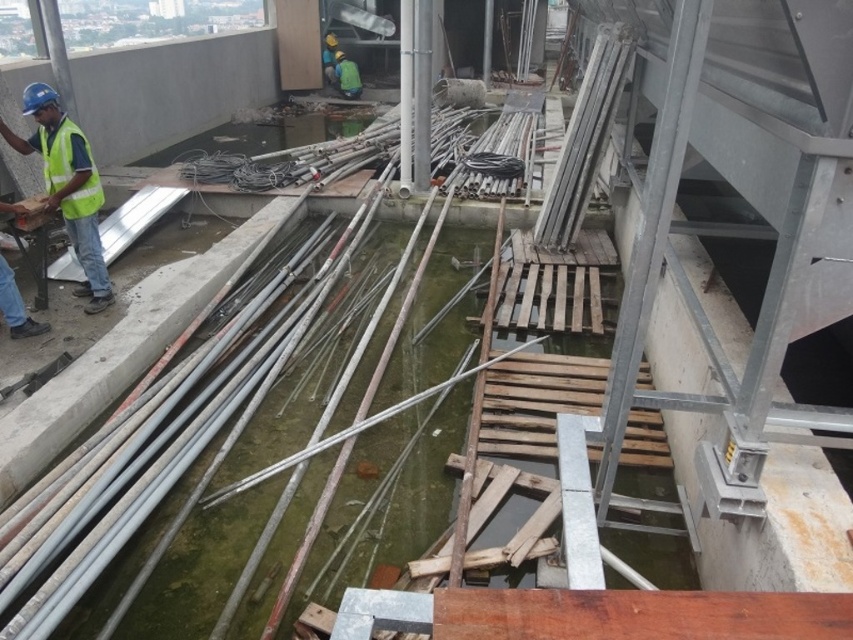
Which is below, yellow reflective vest at left or high-visibility fabric safety vest at left?

yellow reflective vest at left is below.

Does yellow reflective vest at left appear on the left side of high-visibility fabric safety vest at left?

Correct, you'll find yellow reflective vest at left to the left of high-visibility fabric safety vest at left.

Locate an element on the screen. yellow reflective vest at left is located at coordinates (67, 184).